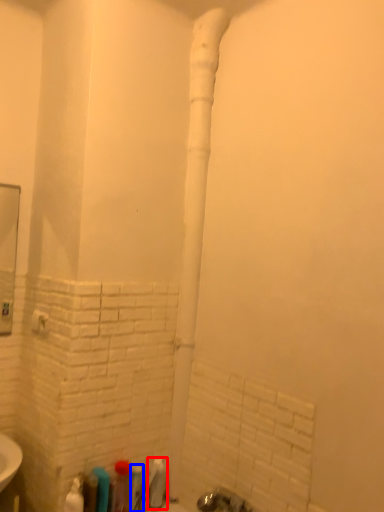
Question: Which object is closer to the camera taking this photo, toiletry (highlighted by a red box) or toiletry (highlighted by a blue box)?

Choices:
 (A) toiletry
 (B) toiletry

Answer: (B)